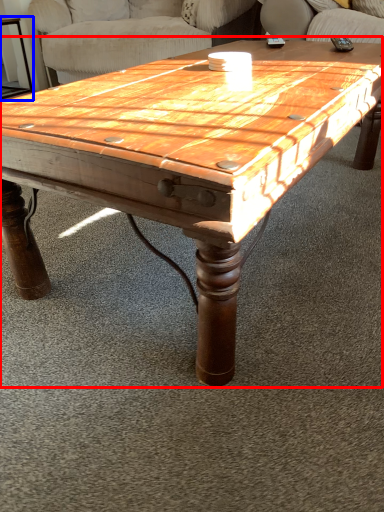
Question: Which object is closer to the camera taking this photo, coffee table (highlighted by a red box) or side table (highlighted by a blue box)?

Choices:
 (A) coffee table
 (B) side table

Answer: (A)